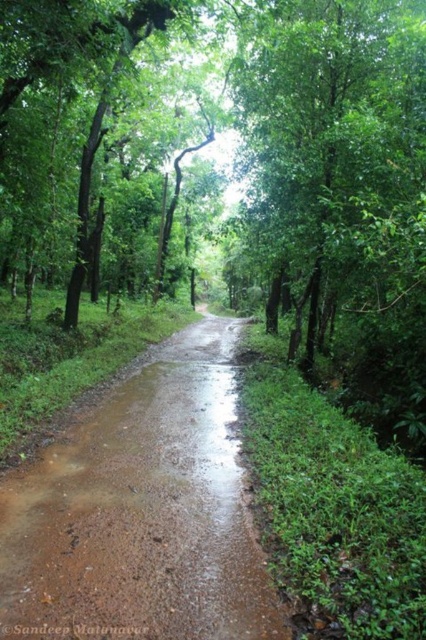
You are a hiker standing on the brown muddy dirt track at center. Looking around, you notice the green leafy tree at center. Which object is closer to the ground?

The brown muddy dirt track at center is closer to the ground since it has a lesser height compared to the green leafy tree at center.

In the scene shown: You are standing at the entrance of the forest and see the brown muddy dirt track at center. Based on its position, can you determine if it leads towards the north or south direction?

The brown muddy dirt track at center is located at point coordinates which do not provide directional information about its orientation. Without additional context about the image orientation or landmarks, it is impossible to determine if it leads north or south.

You are standing on the forest path and want to cross to the other side. The path is bordered by dense vegetation on both sides. There is a point marked at coordinates (x=141, y=513) which is the brown muddy dirt track at center. Can you safely step on that point to cross the path?

The point at coordinates (x=141, y=513) is the brown muddy dirt track at center. Since the path is a dirt road and slightly muddy, stepping on that point would be safe as it is part of the path itself.